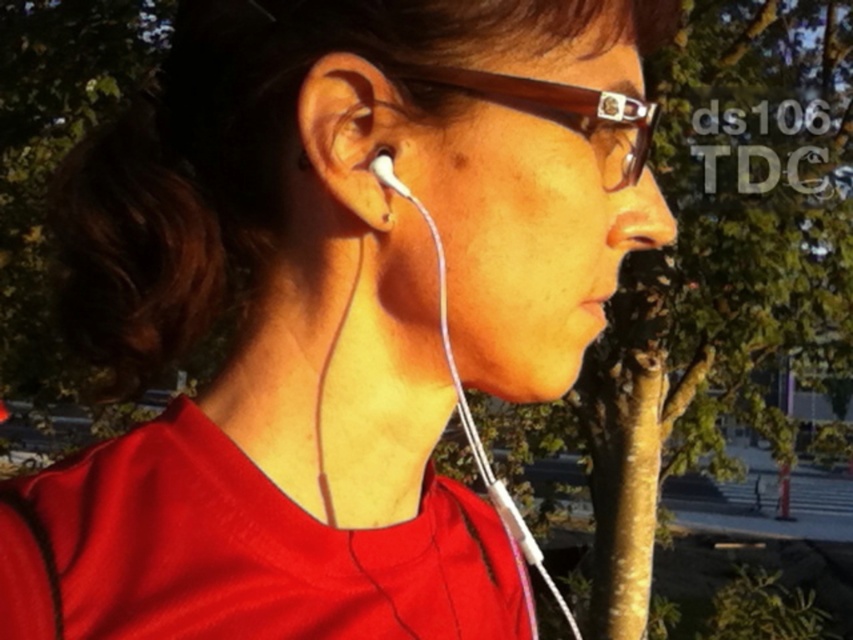
Question: Among these objects, which one is nearest to the camera?

Choices:
 (A) brown textured tree trunk at center
 (B) brown translucent glasses at upper center
 (C) matte white earbud at center

Answer: (B)

Question: Is the position of brown textured tree trunk at center more distant than that of brown translucent glasses at upper center?

Choices:
 (A) no
 (B) yes

Answer: (B)

Question: Is brown textured tree trunk at center further to camera compared to matte white earbud at center?

Choices:
 (A) yes
 (B) no

Answer: (A)

Question: Which point is closer to the camera taking this photo?

Choices:
 (A) (318, 138)
 (B) (663, 67)

Answer: (A)

Question: Estimate the real-world distances between objects in this image. Which object is farther from the white matte earphone at left?

Choices:
 (A) brown textured tree trunk at center
 (B) brown translucent glasses at upper center

Answer: (A)

Question: Is the position of matte white earbud at center less distant than that of brown translucent glasses at upper center?

Choices:
 (A) yes
 (B) no

Answer: (B)